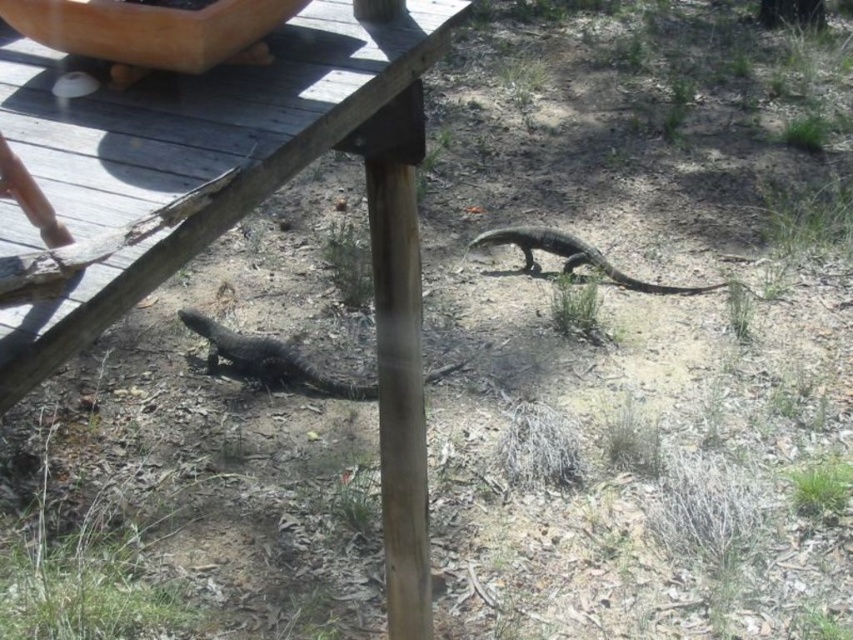
Question: Which point is closer to the camera taking this photo?

Choices:
 (A) (277, 349)
 (B) (407, 234)
 (C) (485, 240)

Answer: (B)

Question: Which point is closer to the camera?

Choices:
 (A) (602, 260)
 (B) (427, 4)
 (C) (206, 332)

Answer: (B)

Question: Based on their relative distances, which object is nearer to the shiny black lizard at lower left?

Choices:
 (A) shiny black lizard at center
 (B) wooden deck at lower left

Answer: (A)

Question: Does shiny black lizard at lower left come behind shiny black lizard at center?

Choices:
 (A) yes
 (B) no

Answer: (B)

Question: From the image, what is the correct spatial relationship of wooden deck at lower left in relation to shiny black lizard at lower left?

Choices:
 (A) above
 (B) below

Answer: (A)

Question: Is shiny black lizard at lower left positioned before shiny black lizard at center?

Choices:
 (A) yes
 (B) no

Answer: (A)